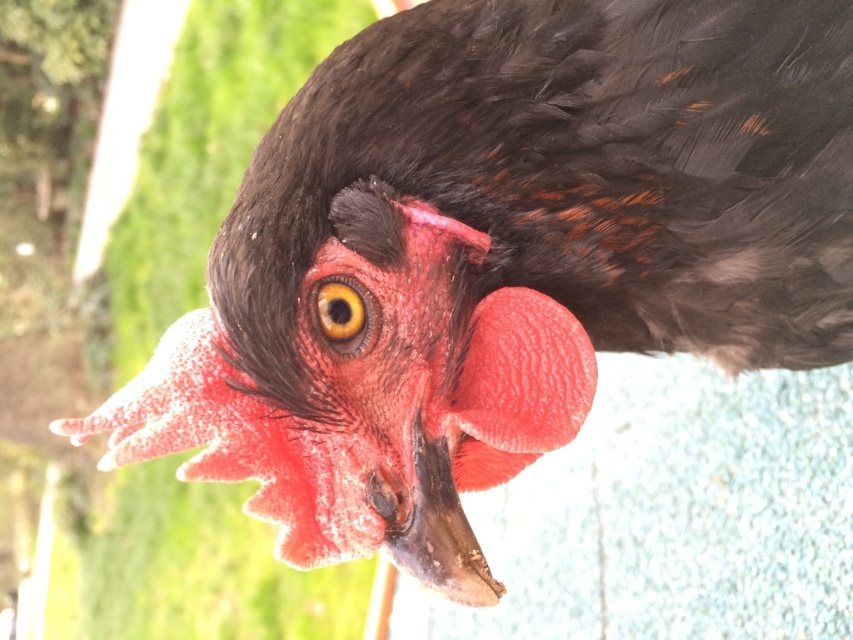
Question: Is slick black beak at center positioned before yellow shiny eye at center?

Choices:
 (A) yes
 (B) no

Answer: (A)

Question: Is slick black beak at center positioned behind yellow shiny eye at center?

Choices:
 (A) yes
 (B) no

Answer: (B)

Question: Which point appears farthest from the camera in this image?

Choices:
 (A) (334, 312)
 (B) (483, 563)

Answer: (A)

Question: Which of the following is the farthest from the observer?

Choices:
 (A) (498, 586)
 (B) (328, 316)

Answer: (B)

Question: Is slick black beak at center to the left of yellow shiny eye at center from the viewer's perspective?

Choices:
 (A) yes
 (B) no

Answer: (B)